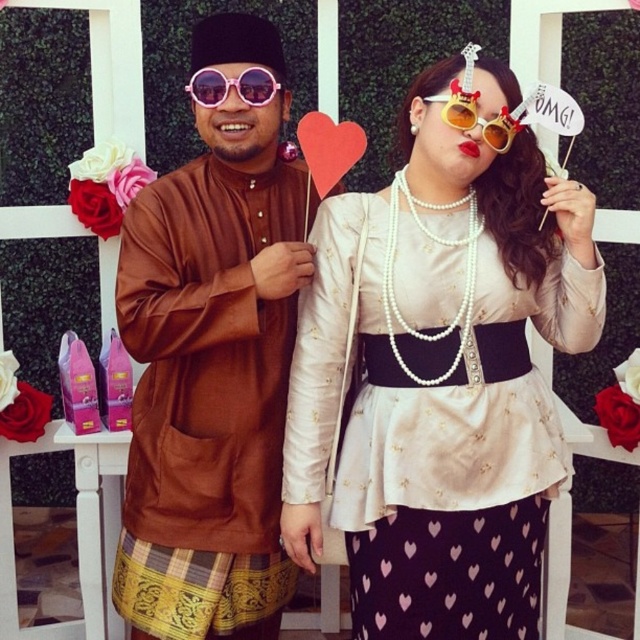
Question: Which object appears farthest from the camera in this image?

Choices:
 (A) gold plastic sunglasses at upper center
 (B) pink reflective sunglasses at center

Answer: (B)

Question: From the image, what is the correct spatial relationship of pearl satin blouse at center in relation to pink reflective sunglasses at center?

Choices:
 (A) above
 (B) below

Answer: (B)

Question: In this image, where is gold plastic sunglasses at upper center located relative to pink reflective sunglasses at center?

Choices:
 (A) above
 (B) below

Answer: (B)

Question: Considering the real-world distances, which object is farthest from the pink reflective sunglasses at center?

Choices:
 (A) brown satin kurta at left
 (B) pearl satin blouse at center

Answer: (B)

Question: Is pearl satin blouse at center to the left of pink reflective sunglasses at center from the viewer's perspective?

Choices:
 (A) no
 (B) yes

Answer: (A)

Question: Which object is the farthest from the gold plastic sunglasses at upper center?

Choices:
 (A) pink reflective sunglasses at center
 (B) pearl satin blouse at center
 (C) brown satin kurta at left

Answer: (C)